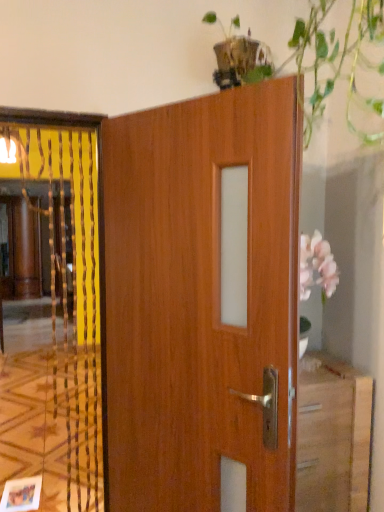
At what (x,y) coordinates should I click in order to perform the action: click on wooden door at center. Please return your answer as a coordinate pair (x, y). Looking at the image, I should click on (198, 301).

Image resolution: width=384 pixels, height=512 pixels. Describe the element at coordinates (198, 301) in the screenshot. I see `wooden door at center` at that location.

Identify the location of wooden elevator at left. Image resolution: width=384 pixels, height=512 pixels. (58, 321).

Describe the element at coordinates (58, 321) in the screenshot. The height and width of the screenshot is (512, 384). I see `wooden elevator at left` at that location.

Where is `wooden door at center`? wooden door at center is located at coordinates (198, 301).

Would you say wooden door at center is to the left or to the right of wooden elevator at left in the picture?

Based on their positions, wooden door at center is located to the right of wooden elevator at left.

Is the position of wooden door at center more distant than that of wooden elevator at left?

No, wooden door at center is in front of wooden elevator at left.

Is point (279, 430) farther from viewer compared to point (66, 482)?

No.

From the image's perspective, who appears lower, wooden door at center or wooden elevator at left?

wooden door at center appears lower in the image.

From a real-world perspective, who is located lower, wooden door at center or wooden elevator at left?

wooden elevator at left, from a real-world perspective.

Can you confirm if wooden door at center is wider than wooden elevator at left?

Yes.

Considering the sizes of objects wooden door at center and wooden elevator at left in the image provided, who is shorter, wooden door at center or wooden elevator at left?

wooden door at center is shorter.

Can you confirm if wooden door at center is bigger than wooden elevator at left?

Indeed, wooden door at center has a larger size compared to wooden elevator at left.

Would you say wooden door at center is outside wooden elevator at left?

wooden door at center lies outside wooden elevator at left's area.

Is wooden door at center next to wooden elevator at left?

wooden door at center and wooden elevator at left are clearly separated.

Is wooden door at center facing away from wooden elevator at left?

No, wooden door at center is not facing away from wooden elevator at left.

The width and height of the screenshot is (384, 512). What are the coordinates of `door located on the right of wooden elevator at left` in the screenshot? It's located at (198, 301).

Is wooden elevator at left to the left of wooden door at center from the viewer's perspective?

Yes.

Does wooden elevator at left lie behind wooden door at center?

That is True.

Which is behind, point (77, 176) or point (128, 136)?

The point (77, 176) is farther from the camera.

From the image's perspective, is wooden elevator at left over wooden door at center?

Yes, from the image's perspective, wooden elevator at left is on top of wooden door at center.

From a real-world perspective, between wooden elevator at left and wooden door at center, who is vertically lower?

From a 3D spatial view, wooden elevator at left is below.

Is wooden elevator at left wider or thinner than wooden door at center?

Clearly, wooden elevator at left has less width compared to wooden door at center.

Looking at this image, is wooden elevator at left taller than wooden door at center?

Indeed, wooden elevator at left has a greater height compared to wooden door at center.

Can you confirm if wooden elevator at left is smaller than wooden door at center?

Yes, wooden elevator at left is smaller than wooden door at center.

Would you say wooden elevator at left is inside or outside wooden door at center?

wooden elevator at left exists outside the volume of wooden door at center.

Would you say wooden elevator at left is a long distance from wooden door at center?

wooden elevator at left is positioned a significant distance from wooden door at center.

Could you tell me if wooden elevator at left is facing wooden door at center?

No, wooden elevator at left is not oriented towards wooden door at center.

Image resolution: width=384 pixels, height=512 pixels. I want to click on elevator lying above the wooden door at center (from the image's perspective), so click(x=58, y=321).

You are a GUI agent. You are given a task and a screenshot of the screen. Output one action in this format:
    pyautogui.click(x=<x>, y=<y>)
    Task: Click on the door that is on the right side of wooden elevator at left
    The height and width of the screenshot is (512, 384).
    Given the screenshot: What is the action you would take?
    pos(198,301)

At what (x,y) coordinates should I click in order to perform the action: click on door above the wooden elevator at left (from a real-world perspective). Please return your answer as a coordinate pair (x, y). The width and height of the screenshot is (384, 512). Looking at the image, I should click on (198, 301).